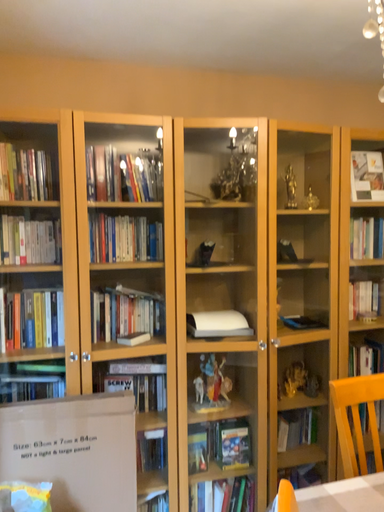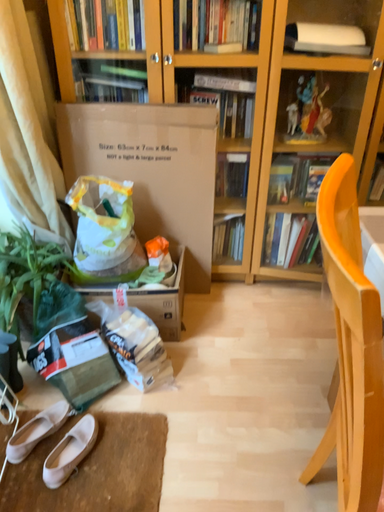
Question: Which way did the camera rotate in the video?

Choices:
 (A) rotated right
 (B) rotated left

Answer: (B)